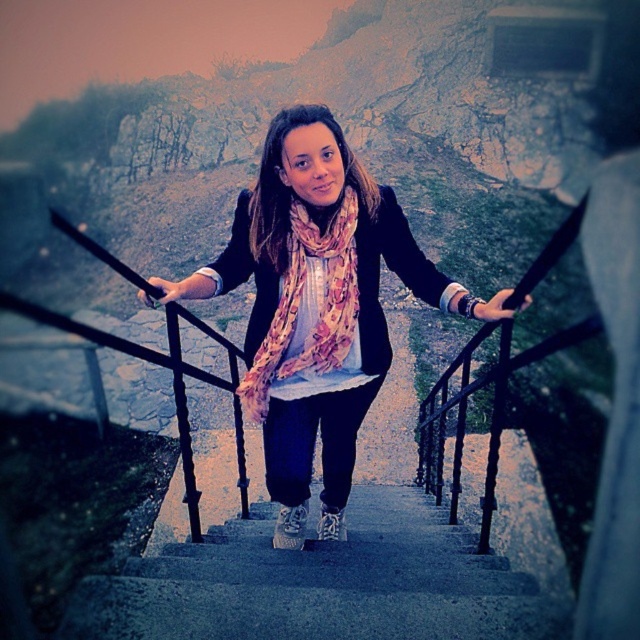
Who is taller, concrete stairs at center or floral silk scarf at center?

With more height is floral silk scarf at center.

Between concrete stairs at center and floral silk scarf at center, which one is positioned lower?

concrete stairs at center is lower down.

Image resolution: width=640 pixels, height=640 pixels. Describe the element at coordinates (330, 582) in the screenshot. I see `concrete stairs at center` at that location.

The width and height of the screenshot is (640, 640). I want to click on concrete stairs at center, so click(x=330, y=582).

Is point (268, 362) positioned in front of point (301, 212)?

No.

Between pink floral scarf at center and floral silk scarf at center, which one appears on the left side from the viewer's perspective?

floral silk scarf at center is more to the left.

The width and height of the screenshot is (640, 640). What do you see at coordinates (316, 307) in the screenshot?
I see `pink floral scarf at center` at bounding box center [316, 307].

In order to click on pink floral scarf at center in this screenshot , I will do `click(316, 307)`.

Between point (332, 426) and point (417, 563), which one is positioned in front?

Point (417, 563) is in front.

Describe the element at coordinates (316, 307) in the screenshot. I see `pink floral scarf at center` at that location.

The height and width of the screenshot is (640, 640). Identify the location of pink floral scarf at center. (316, 307).